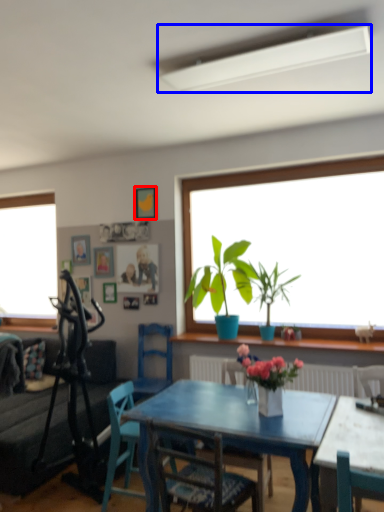
Question: Which of the following is the farthest to the observer, picture frame (highlighted by a red box) or lamp (highlighted by a blue box)?

Choices:
 (A) picture frame
 (B) lamp

Answer: (A)